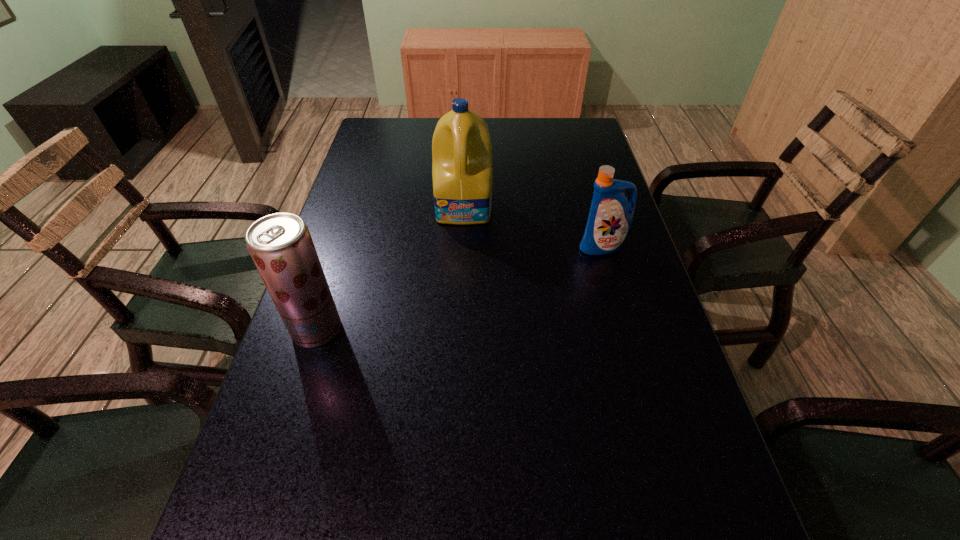
The width and height of the screenshot is (960, 540). I want to click on the left detergent, so click(x=461, y=146).

Find the location of `the farther detergent`. the farther detergent is located at coordinates (461, 146).

Where is `fruit juice`? The height and width of the screenshot is (540, 960). fruit juice is located at coordinates (280, 244).

You are a GUI agent. You are given a task and a screenshot of the screen. Output one action in this format:
    pyautogui.click(x=<x>, y=<y>)
    Task: Click on the leftmost object
    
    Given the screenshot: What is the action you would take?
    pyautogui.click(x=280, y=244)

Identify the location of the shortest object. (610, 217).

In order to click on the second farthest object in this screenshot , I will do `click(610, 217)`.

In order to click on free space located 0.330m on the label of the farther detergent in this screenshot , I will do `click(460, 327)`.

The width and height of the screenshot is (960, 540). Find the location of `vacant space located on the front of the nearest object`. vacant space located on the front of the nearest object is located at coordinates (287, 421).

Identify the location of vacant area situated 0.220m on the label of the rightmost object. This screenshot has width=960, height=540. (626, 329).

Image resolution: width=960 pixels, height=540 pixels. I want to click on object present at the left edge, so click(x=280, y=244).